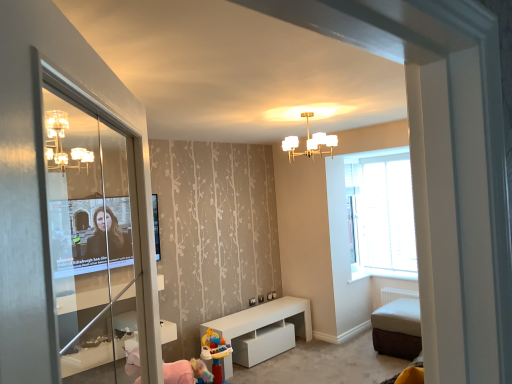
At what (x,y) coordinates should I click in order to perform the action: click on clear glass screen door at left. Please return your answer as a coordinate pair (x, y). The image size is (512, 384). Looking at the image, I should click on (90, 221).

How different are the orientations of clear glass screen door at left and white matte table at center in degrees?

The facing directions of clear glass screen door at left and white matte table at center are 129 degrees apart.

Is clear glass screen door at left next to white matte table at center?

No, clear glass screen door at left is not making contact with white matte table at center.

Is clear glass screen door at left wider than white matte table at center?

In fact, clear glass screen door at left might be narrower than white matte table at center.

Does clear glass screen door at left appear on the right side of white matte table at center?

Incorrect, clear glass screen door at left is not on the right side of white matte table at center.

Between transparent glass window at right and white glass chandelier at upper center, which one has larger size?

With larger size is transparent glass window at right.

How different are the orientations of transparent glass window at right and white glass chandelier at upper center in degrees?

90 degrees.

From the image's perspective, would you say transparent glass window at right is shown under white glass chandelier at upper center?

Yes, from the image's perspective, transparent glass window at right is beneath white glass chandelier at upper center.

From a real-world perspective, which is physically below, transparent glass window at right or white glass chandelier at upper center?

transparent glass window at right is physically lower.

From the image's perspective, would you say white matte table at center is shown under transparent glass window at right?

Correct, white matte table at center appears lower than transparent glass window at right in the image.

Considering the sizes of objects white matte table at center and transparent glass window at right in the image provided, who is smaller, white matte table at center or transparent glass window at right?

transparent glass window at right.

Does white matte table at center have a lesser height compared to transparent glass window at right?

Indeed, white matte table at center has a lesser height compared to transparent glass window at right.

Is white glass chandelier at upper center directly adjacent to clear glass screen door at left?

white glass chandelier at upper center and clear glass screen door at left are clearly separated.

Does white glass chandelier at upper center appear on the right side of clear glass screen door at left?

Yes, white glass chandelier at upper center is to the right of clear glass screen door at left.

Is clear glass screen door at left a part of white glass chandelier at upper center?

No.

You are a GUI agent. You are given a task and a screenshot of the screen. Output one action in this format:
    pyautogui.click(x=<x>, y=<y>)
    Task: Click on the window on the right side of white glass chandelier at upper center
    The width and height of the screenshot is (512, 384).
    Given the screenshot: What is the action you would take?
    pyautogui.click(x=380, y=214)

How different are the orientations of white glass chandelier at upper center and transparent glass window at right in degrees?

The angular difference between white glass chandelier at upper center and transparent glass window at right is 90 degrees.

Is white glass chandelier at upper center inside the boundaries of transparent glass window at right, or outside?

white glass chandelier at upper center is located beyond the bounds of transparent glass window at right.

Does white glass chandelier at upper center turn towards transparent glass window at right?

No.

Identify the location of window that appears behind the white fabric ottoman at lower right. The image size is (512, 384). (380, 214).

Which of these two, transparent glass window at right or white fabric ottoman at lower right, is wider?

white fabric ottoman at lower right is wider.

Who is bigger, transparent glass window at right or white fabric ottoman at lower right?

With larger size is white fabric ottoman at lower right.

Which of these two, white matte table at center or white glass chandelier at upper center, is thinner?

white matte table at center is thinner.

From the picture: Is white matte table at center turned away from white glass chandelier at upper center?

Answer: No, white glass chandelier at upper center is not at the back of white matte table at center.

Can white glass chandelier at upper center be found inside white matte table at center?

Actually, white glass chandelier at upper center is outside white matte table at center.

How distant is white matte table at center from white glass chandelier at upper center?

They are 1.92 meters apart.

You are a GUI agent. You are given a task and a screenshot of the screen. Output one action in this format:
    pyautogui.click(x=<x>, y=<y>)
    Task: Click on the table lying below the clear glass screen door at left (from the image's perspective)
    The height and width of the screenshot is (384, 512).
    Given the screenshot: What is the action you would take?
    point(260,331)

You are a GUI agent. You are given a task and a screenshot of the screen. Output one action in this format:
    pyautogui.click(x=<x>, y=<y>)
    Task: Click on the light fixture above the transparent glass window at right (from the image's perspective)
    The height and width of the screenshot is (384, 512).
    Given the screenshot: What is the action you would take?
    pyautogui.click(x=310, y=142)

Estimate the real-world distances between objects in this image. Which object is further from clear glass screen door at left, transparent glass window at right or white fabric ottoman at lower right?

transparent glass window at right is positioned further to the anchor clear glass screen door at left.

From the image, which object appears to be nearer to white glass chandelier at upper center, white fabric ottoman at lower right or clear glass screen door at left?

clear glass screen door at left.

From the image, which object appears to be farther from white matte table at center, white glass chandelier at upper center or white fabric ottoman at lower right?

white glass chandelier at upper center is further to white matte table at center.

Which object lies nearer to the anchor point white matte table at center, white fabric ottoman at lower right or clear glass screen door at left?

Among the two, white fabric ottoman at lower right is located nearer to white matte table at center.

Estimate the real-world distances between objects in this image. Which object is further from clear glass screen door at left, white matte table at center or white glass chandelier at upper center?

The object further to clear glass screen door at left is white glass chandelier at upper center.

When comparing their distances from white fabric ottoman at lower right, does clear glass screen door at left or white matte table at center seem further?

clear glass screen door at left.

From the image, which object appears to be nearer to white matte table at center, clear glass screen door at left or white fabric ottoman at lower right?

Based on the image, white fabric ottoman at lower right appears to be nearer to white matte table at center.

Looking at the image, which one is located further to white matte table at center, transparent glass window at right or white fabric ottoman at lower right?

transparent glass window at right lies further to white matte table at center than the other object.

I want to click on table between clear glass screen door at left and transparent glass window at right from front to back, so tap(260, 331).

Identify the location of light fixture positioned between clear glass screen door at left and transparent glass window at right from near to far. This screenshot has height=384, width=512. (310, 142).

At what (x,y) coordinates should I click in order to perform the action: click on furniture between clear glass screen door at left and transparent glass window at right in the front-back direction. Please return your answer as a coordinate pair (x, y). Looking at the image, I should click on (397, 329).

What are the coordinates of `table between white glass chandelier at upper center and transparent glass window at right in the front-back direction` in the screenshot? It's located at (260, 331).